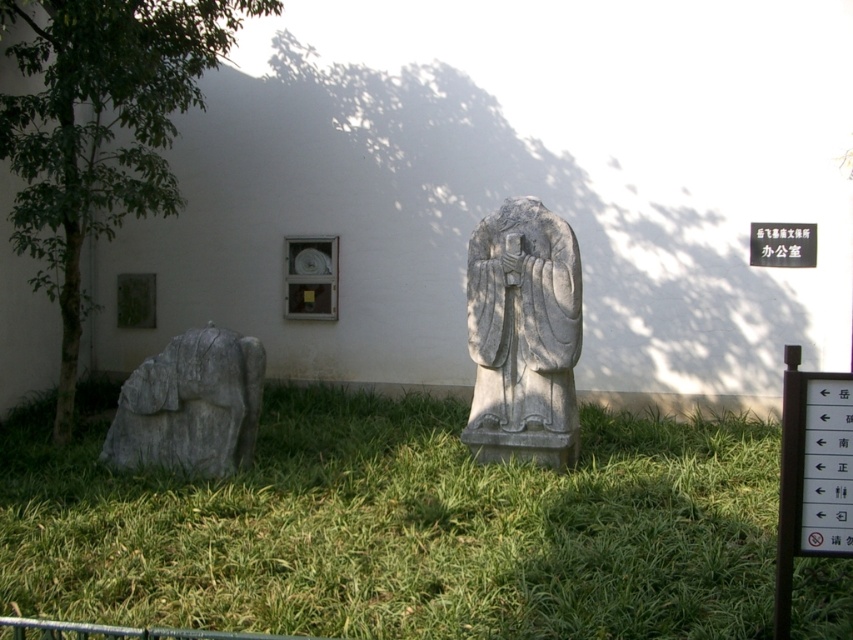
Question: Which point is closer to the camera?

Choices:
 (A) white paper sign at upper center
 (B) gray stone statue at lower left
 (C) gray stone statue at center
 (D) green leafy tree at left

Answer: (C)

Question: Is green grass at center bigger than gray stone statue at center?

Choices:
 (A) no
 (B) yes

Answer: (B)

Question: Is gray stone statue at center wider than gray stone statue at lower left?

Choices:
 (A) no
 (B) yes

Answer: (A)

Question: Which of these objects is positioned closest to the green leafy tree at left?

Choices:
 (A) white paper sign at upper center
 (B) gray stone statue at center

Answer: (B)

Question: Is gray stone statue at center below gray stone statue at lower left?

Choices:
 (A) no
 (B) yes

Answer: (A)

Question: Which object appears closest to the camera in this image?

Choices:
 (A) green grass at center
 (B) white paper sign at upper center
 (C) green leafy tree at left

Answer: (A)